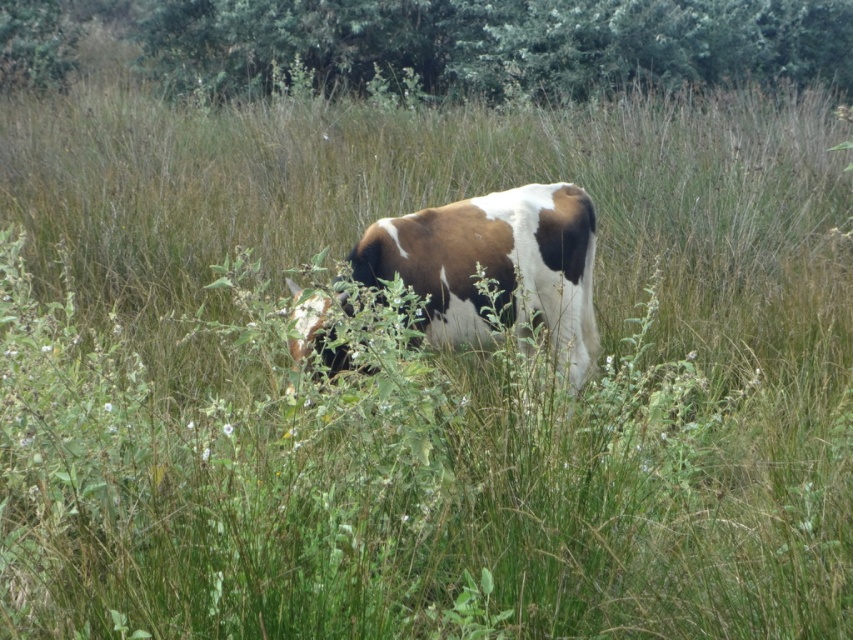
You are standing in the field with the cow and want to take a photo of the green leafy tree at upper center. If your camera can focus on objects up to 15 meters away, will you be able to capture a clear photo of the tree?

The green leafy tree at upper center and camera are 13.01 meters apart from each other. Since the camera can focus up to 15 meters, you can capture a clear photo of the tree as the distance is within the camera range.

You are a photographer trying to capture the cow in the scene. Since the green leafy tree at upper center and the brown and white fur at center are both in your viewfinder, which object should you focus on to ensure the cow is the main subject?

The brown and white fur at center is the cow, so you should focus on it to ensure the cow is the main subject. The green leafy tree at upper center is larger but it is just part of the background.